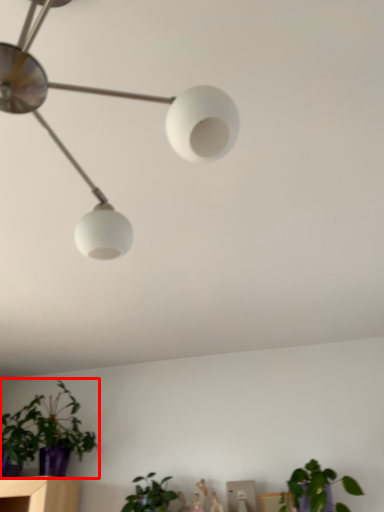
Question: From the image, what is the correct spatial relationship of houseplant (annotated by the red box) in relation to houseplant?

Choices:
 (A) left
 (B) right

Answer: (A)